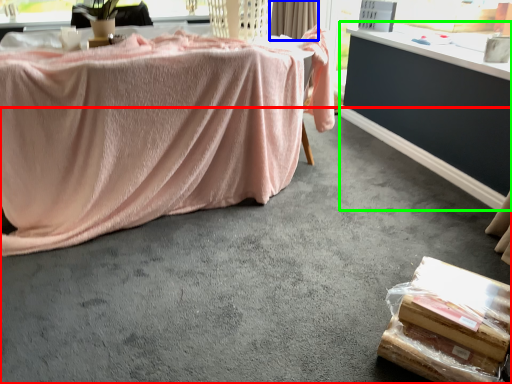
Question: Which is farther away from concrete (highlighted by a red box)? curtain (highlighted by a blue box) or table (highlighted by a green box)?

Choices:
 (A) curtain
 (B) table

Answer: (A)